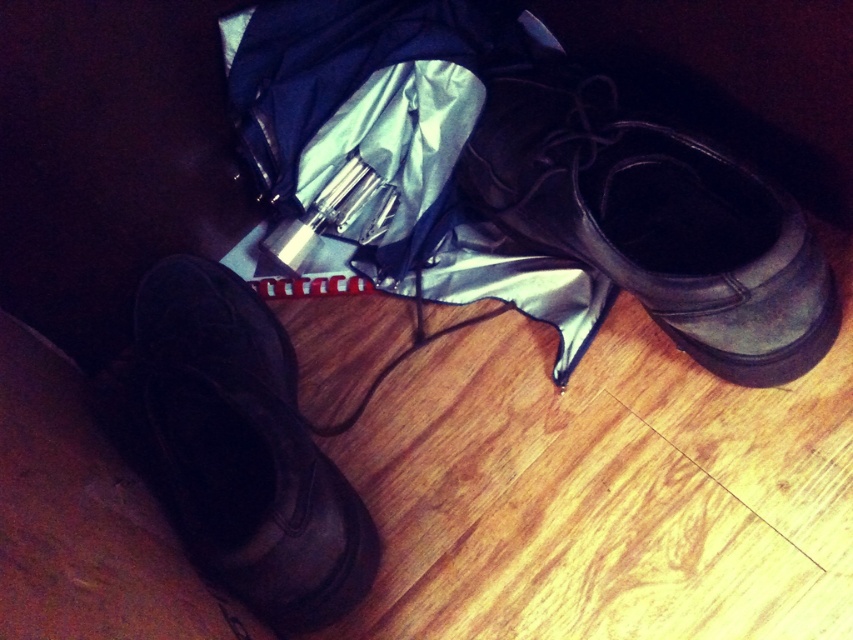
You are standing in a room and see the leather boot at center and the matte black boot at lower left. Which boot is higher up in the image?

The leather boot at center is above the matte black boot at lower left in the image.

You are standing in a room where there are a silvery fabric umbrella at center and a matte black boot at lower left. If you want to pick up the boot, will you need to move the umbrella first?

The silvery fabric umbrella at center is positioned over matte black boot at lower left, so you will need to move the umbrella first to access the boot.

You are standing in a room and see the silvery fabric umbrella at center and the leather boot at center. Which object is located to the left when viewed from your perspective?

The silvery fabric umbrella at center is positioned on the left side of leather boot at center, so it is located to the left.